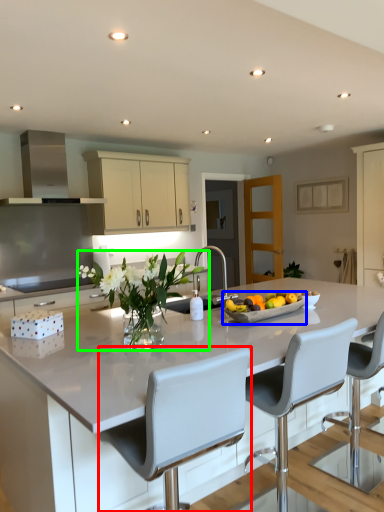
Question: Estimate the real-world distances between objects in this image. Which object is farther from chair (highlighted by a red box), fruit dish (highlighted by a blue box) or floral arrangement (highlighted by a green box)?

Choices:
 (A) fruit dish
 (B) floral arrangement

Answer: (A)